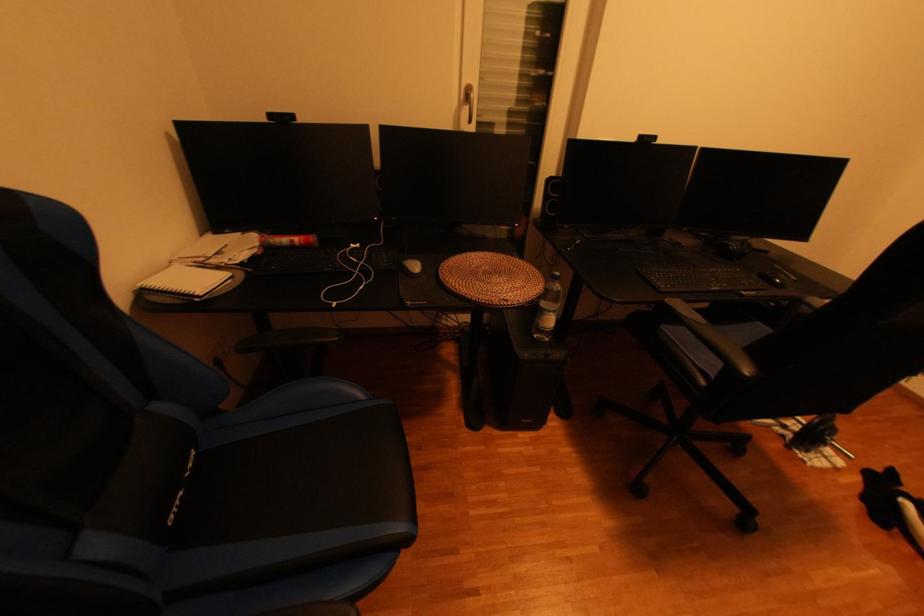
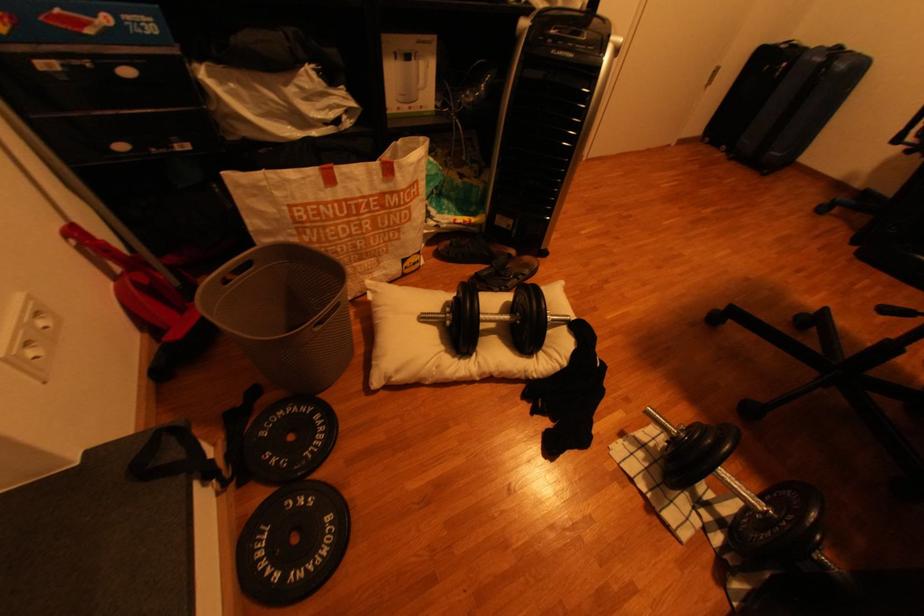
In the second image, find the point that corresponds to point (827, 454) in the first image.

(665, 446)